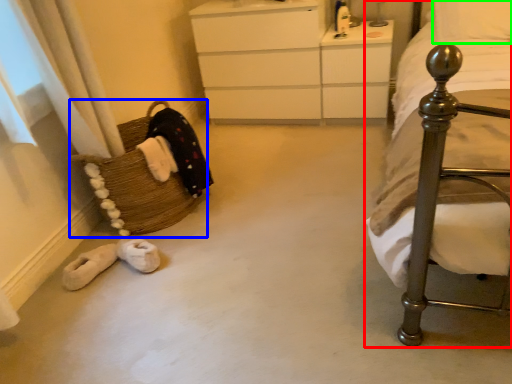
Question: Estimate the real-world distances between objects in this image. Which object is farther from bed (highlighted by a red box), basket (highlighted by a blue box) or pillow (highlighted by a green box)?

Choices:
 (A) basket
 (B) pillow

Answer: (A)